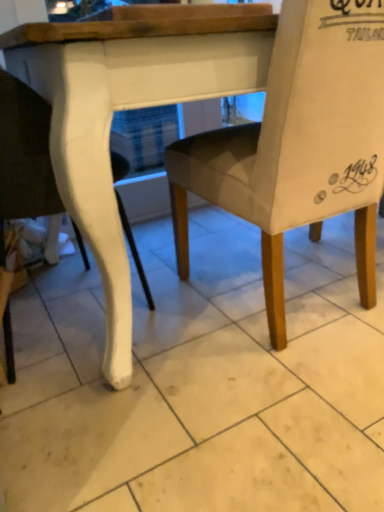
In order to face light gray fabric chair at center, the second chair in the left-to-right sequence, should I rotate leftwards or rightwards?

It's best to rotate right around 11.829 degrees.

Identify the location of white glossy tile at center. This screenshot has height=512, width=384. click(202, 382).

The image size is (384, 512). I want to click on white glossy chair leg at left, the 2th chair positioned from the right, so click(x=25, y=153).

Is light gray fabric chair at center, which appears as the first chair when viewed from the right, to the left of white glossy chair leg at left, which ranks as the 1th chair in left-to-right order, from the viewer's perspective?

No, light gray fabric chair at center, which appears as the first chair when viewed from the right, is not to the left of white glossy chair leg at left, which ranks as the 1th chair in left-to-right order.

Does light gray fabric chair at center, the second chair in the left-to-right sequence, have a smaller size compared to white glossy chair leg at left, the 2th chair positioned from the right?

No, light gray fabric chair at center, the second chair in the left-to-right sequence, is not smaller than white glossy chair leg at left, the 2th chair positioned from the right.

Is white glossy chair leg at left, which ranks as the 1th chair in left-to-right order, located within light gray fabric chair at center, which appears as the first chair when viewed from the right?

No, white glossy chair leg at left, which ranks as the 1th chair in left-to-right order, is not surrounded by light gray fabric chair at center, which appears as the first chair when viewed from the right.

Is the depth of light gray fabric chair at center, which appears as the first chair when viewed from the right, greater than that of white glossy chair leg at left, which ranks as the 1th chair in left-to-right order?

No, light gray fabric chair at center, which appears as the first chair when viewed from the right, is closer to the viewer.

Is light gray fabric chair at center, which appears as the first chair when viewed from the right, in contact with white glossy tile at center?

No, light gray fabric chair at center, which appears as the first chair when viewed from the right, is not next to white glossy tile at center.

Which point is more distant from viewer, [183,144] or [144,411]?

The point [183,144] is behind.

From the image's perspective, is light gray fabric chair at center, the second chair in the left-to-right sequence, positioned above or below white glossy tile at center?

From the image's perspective, light gray fabric chair at center, the second chair in the left-to-right sequence, appears above white glossy tile at center.

Between light gray fabric chair at center, the second chair in the left-to-right sequence, and white glossy tile at center, which one has smaller size?

With smaller size is white glossy tile at center.

Is white glossy chair leg at left, the 2th chair positioned from the right, next to white glossy tile at center and touching it?

No, white glossy chair leg at left, the 2th chair positioned from the right, is not next to white glossy tile at center.

Is white glossy chair leg at left, the 2th chair positioned from the right, smaller than white glossy tile at center?

No.

From the image's perspective, is white glossy chair leg at left, the 2th chair positioned from the right, under white glossy tile at center?

Actually, white glossy chair leg at left, the 2th chair positioned from the right, appears above white glossy tile at center in the image.

Relative to white glossy tile at center, is white glossy chair leg at left, which ranks as the 1th chair in left-to-right order, in front or behind?

Visually, white glossy chair leg at left, which ranks as the 1th chair in left-to-right order, is located behind white glossy tile at center.

Is white glossy chair leg at left, which ranks as the 1th chair in left-to-right order, with light gray fabric chair at center, the second chair in the left-to-right sequence?

No, white glossy chair leg at left, which ranks as the 1th chair in left-to-right order, is not making contact with light gray fabric chair at center, the second chair in the left-to-right sequence.

Considering the positions of objects white glossy chair leg at left, the 2th chair positioned from the right, and light gray fabric chair at center, the second chair in the left-to-right sequence, in the image provided, who is more to the left, white glossy chair leg at left, the 2th chair positioned from the right, or light gray fabric chair at center, the second chair in the left-to-right sequence,?

From the viewer's perspective, white glossy chair leg at left, the 2th chair positioned from the right, appears more on the left side.

How far apart are white glossy chair leg at left, the 2th chair positioned from the right, and light gray fabric chair at center, which appears as the first chair when viewed from the right?

The distance of white glossy chair leg at left, the 2th chair positioned from the right, from light gray fabric chair at center, which appears as the first chair when viewed from the right, is 18.21 inches.

Considering the positions of point (129, 226) and point (339, 210), is point (129, 226) closer or farther from the camera than point (339, 210)?

Point (129, 226) is positioned farther from the camera compared to point (339, 210).

Is white glossy tile at center taller than light gray fabric chair at center, the second chair in the left-to-right sequence?

No, white glossy tile at center is not taller than light gray fabric chair at center, the second chair in the left-to-right sequence.

Based on the photo, is white glossy tile at center aimed at light gray fabric chair at center, the second chair in the left-to-right sequence?

No, white glossy tile at center is not aimed at light gray fabric chair at center, the second chair in the left-to-right sequence.

From the image's perspective, between white glossy tile at center and light gray fabric chair at center, the second chair in the left-to-right sequence, who is located below?

white glossy tile at center appears lower in the image.

Who is bigger, white glossy tile at center or light gray fabric chair at center, which appears as the first chair when viewed from the right?

With larger size is light gray fabric chair at center, which appears as the first chair when viewed from the right.

Consider the image. Does white glossy tile at center turn towards white glossy chair leg at left, which ranks as the 1th chair in left-to-right order?

No, white glossy tile at center is not aimed at white glossy chair leg at left, which ranks as the 1th chair in left-to-right order.

Considering the points (43, 421) and (8, 313), which point is in front, point (43, 421) or point (8, 313)?

Positioned in front is point (43, 421).

Can you confirm if white glossy tile at center is thinner than white glossy chair leg at left, which ranks as the 1th chair in left-to-right order?

Incorrect, the width of white glossy tile at center is not less than that of white glossy chair leg at left, which ranks as the 1th chair in left-to-right order.

At what (x,y) coordinates should I click in order to perform the action: click on chair behind the light gray fabric chair at center, which appears as the first chair when viewed from the right. Please return your answer as a coordinate pair (x, y). The image size is (384, 512). Looking at the image, I should click on tap(25, 153).

I want to click on tile in front of the light gray fabric chair at center, which appears as the first chair when viewed from the right, so click(202, 382).

Which object lies nearer to the anchor point white glossy tile at center, white glossy chair leg at left, the 2th chair positioned from the right, or light gray fabric chair at center, the second chair in the left-to-right sequence?

light gray fabric chair at center, the second chair in the left-to-right sequence, is closer to white glossy tile at center.

Considering their positions, is white glossy tile at center positioned closer to light gray fabric chair at center, the second chair in the left-to-right sequence, than white glossy chair leg at left, the 2th chair positioned from the right?

white glossy tile at center is positioned closer to the anchor light gray fabric chair at center, the second chair in the left-to-right sequence.

When comparing their distances from light gray fabric chair at center, the second chair in the left-to-right sequence, does white glossy chair leg at left, which ranks as the 1th chair in left-to-right order, or white glossy tile at center seem further?

white glossy chair leg at left, which ranks as the 1th chair in left-to-right order.

Estimate the real-world distances between objects in this image. Which object is closer to white glossy tile at center, light gray fabric chair at center, which appears as the first chair when viewed from the right, or white glossy chair leg at left, which ranks as the 1th chair in left-to-right order?

The object closer to white glossy tile at center is light gray fabric chair at center, which appears as the first chair when viewed from the right.

Estimate the real-world distances between objects in this image. Which object is closer to white glossy chair leg at left, the 2th chair positioned from the right, white glossy tile at center or light gray fabric chair at center, the second chair in the left-to-right sequence?

Based on the image, light gray fabric chair at center, the second chair in the left-to-right sequence, appears to be nearer to white glossy chair leg at left, the 2th chair positioned from the right.

Considering their positions, is light gray fabric chair at center, which appears as the first chair when viewed from the right, positioned closer to white glossy chair leg at left, the 2th chair positioned from the right, than white glossy tile at center?

light gray fabric chair at center, which appears as the first chair when viewed from the right.

In order to click on tile located between white glossy chair leg at left, the 2th chair positioned from the right, and light gray fabric chair at center, which appears as the first chair when viewed from the right, in the left-right direction in this screenshot , I will do `click(202, 382)`.